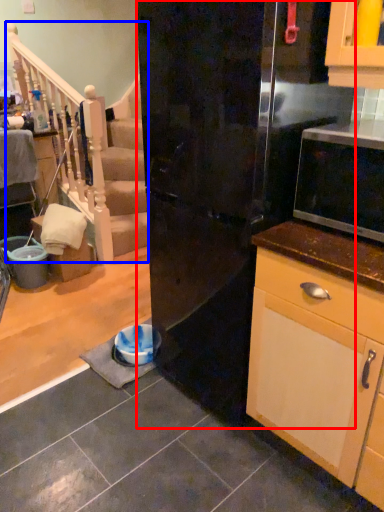
Question: Which point is further to the camera, refrigerator (highlighted by a red box) or rail (highlighted by a blue box)?

Choices:
 (A) refrigerator
 (B) rail

Answer: (B)